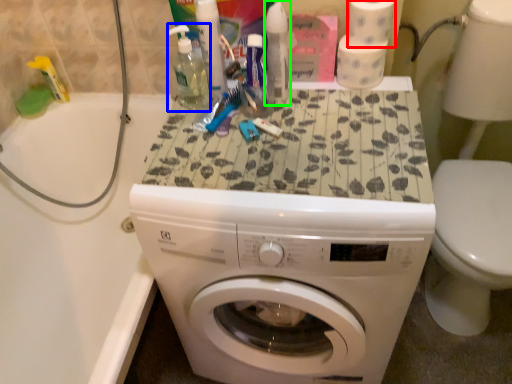
Question: Based on their relative distances, which object is farther from toilet paper (highlighted by a red box)? Choose from cleaning product (highlighted by a blue box) and cleaning product (highlighted by a green box).

Choices:
 (A) cleaning product
 (B) cleaning product

Answer: (A)